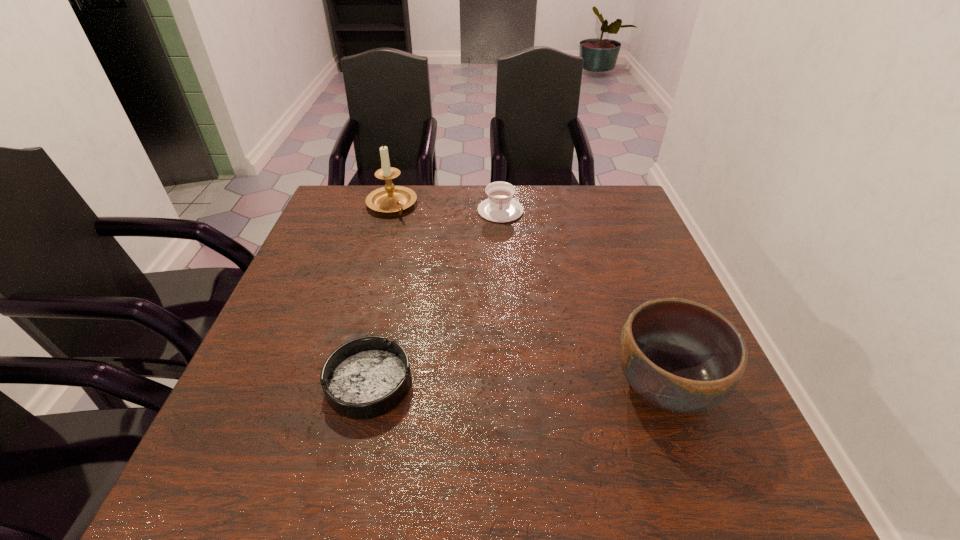
Where is `vacant area situated 0.060m on the handle side of the teacup`? The image size is (960, 540). vacant area situated 0.060m on the handle side of the teacup is located at coordinates (502, 235).

Image resolution: width=960 pixels, height=540 pixels. Identify the location of vacant space positioned with a handle on the side of the tallest object. (418, 240).

This screenshot has width=960, height=540. What are the coordinates of `vacant area situated with a handle on the side of the tallest object` in the screenshot? It's located at (420, 242).

This screenshot has width=960, height=540. I want to click on vacant region located 0.370m with a handle on the side of the tallest object, so click(460, 294).

Locate an element on the screen. teacup at the far edge is located at coordinates (500, 207).

Where is `candle holder that is positioned at the far edge`? Image resolution: width=960 pixels, height=540 pixels. candle holder that is positioned at the far edge is located at coordinates (390, 198).

Find the location of a particular element. ashtray located in the near edge section of the desktop is located at coordinates (364, 378).

Where is `bowl that is at the near edge`? bowl that is at the near edge is located at coordinates (681, 356).

The height and width of the screenshot is (540, 960). Identify the location of object that is at the left edge. (390, 198).

Locate an element on the screen. The height and width of the screenshot is (540, 960). object that is at the right edge is located at coordinates (681, 356).